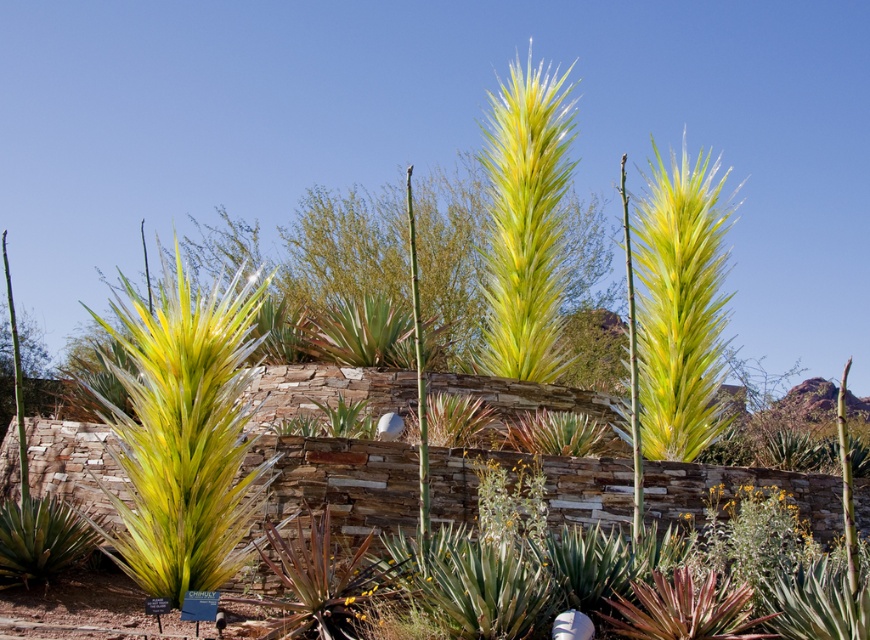
Question: Is translucent yellow glass plant at lower left behind yellow-green glass flower at center?

Choices:
 (A) yes
 (B) no

Answer: (A)

Question: Does translucent yellow glass plant at lower left have a greater width compared to yellow-green glass flower at center?

Choices:
 (A) no
 (B) yes

Answer: (A)

Question: Which object is farther from the camera taking this photo?

Choices:
 (A) translucent yellow glass plant at lower left
 (B) yellow-green glass flower at center

Answer: (A)

Question: Is the position of translucent yellow glass plant at lower left less distant than that of yellow-green glass flower at center?

Choices:
 (A) no
 (B) yes

Answer: (A)